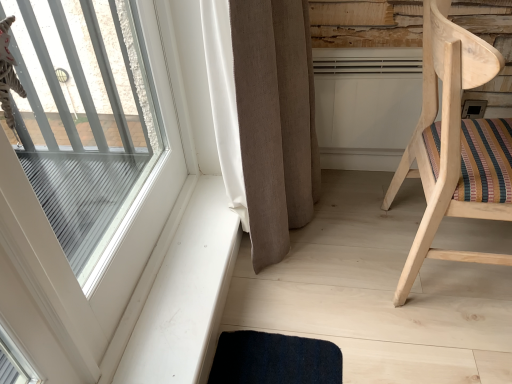
The height and width of the screenshot is (384, 512). Find the location of `vacant area that lies to the right of beige fabric curtain at center`. vacant area that lies to the right of beige fabric curtain at center is located at coordinates (349, 211).